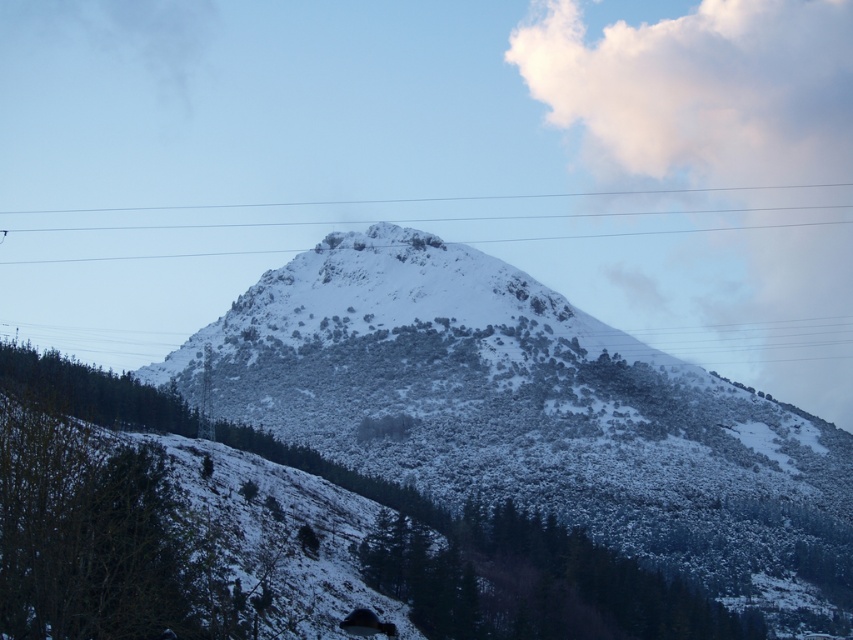
Question: Which of the following is the closest to the observer?

Choices:
 (A) white snow-covered mountain at center
 (B) white fluffy cloud at upper center

Answer: (A)

Question: Which point appears farthest from the camera in this image?

Choices:
 (A) (808, 115)
 (B) (265, 292)

Answer: (A)

Question: Does white snow-covered mountain at center come behind white fluffy cloud at upper center?

Choices:
 (A) yes
 (B) no

Answer: (B)

Question: Can you confirm if white snow-covered mountain at center is positioned below white fluffy cloud at upper center?

Choices:
 (A) yes
 (B) no

Answer: (A)

Question: Is white snow-covered mountain at center in front of white fluffy cloud at upper center?

Choices:
 (A) no
 (B) yes

Answer: (B)